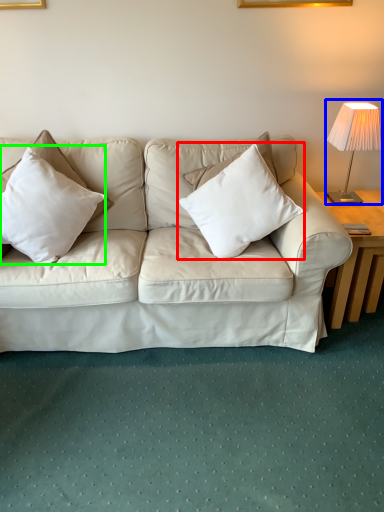
Question: Based on their relative distances, which object is nearer to pillow (highlighted by a red box)? Choose from table lamp (highlighted by a blue box) and pillow (highlighted by a green box).

Choices:
 (A) table lamp
 (B) pillow

Answer: (A)